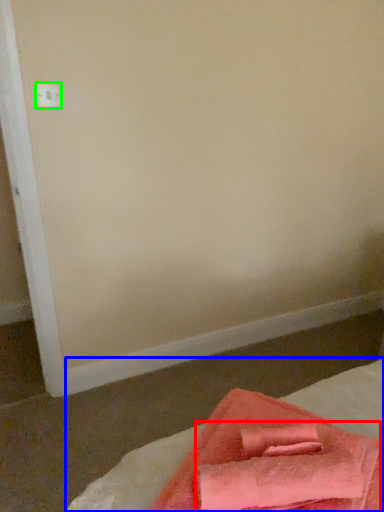
Question: Considering the real-world distances, which object is closest to bath towel (highlighted by a red box)? bed (highlighted by a blue box) or electric outlet (highlighted by a green box).

Choices:
 (A) bed
 (B) electric outlet

Answer: (A)